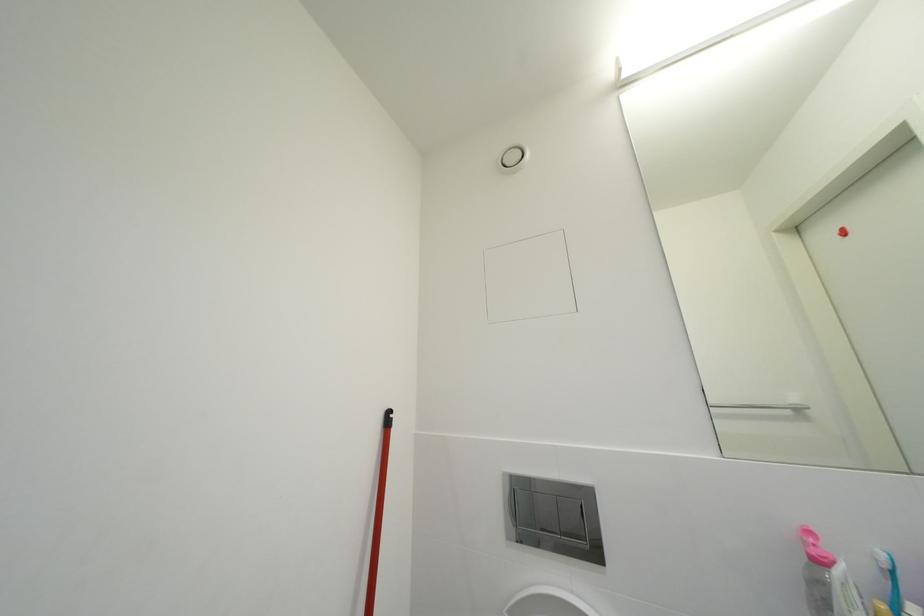
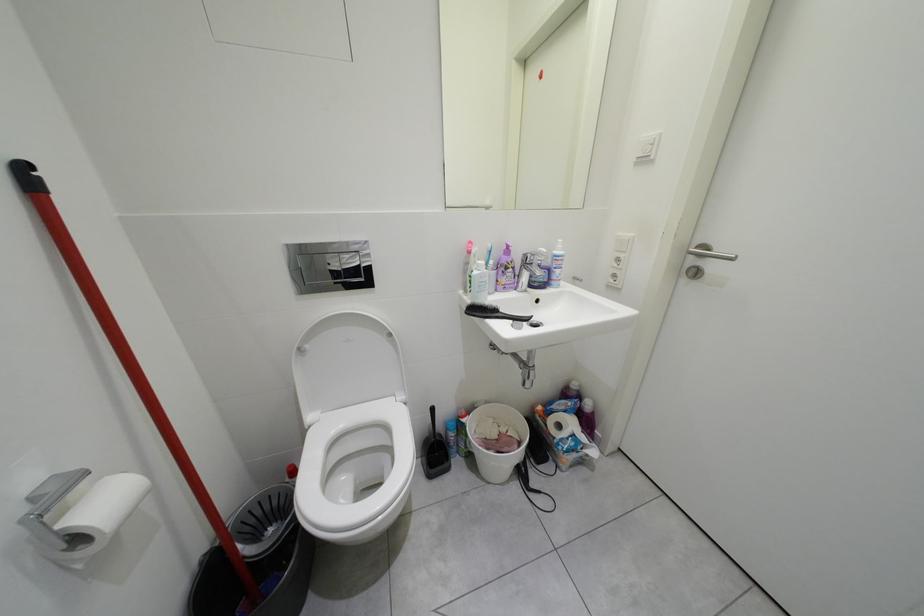
Based on the continuous images, in which direction is the camera rotating?

The camera's rotation is toward right-down.